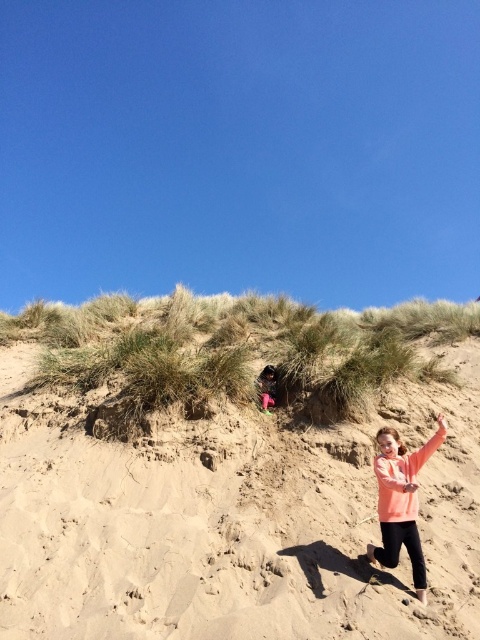
Looking at this image, is green grassy hillside at upper center behind pink fabric at center?

No, green grassy hillside at upper center is closer to the viewer.

At what (x,y) coordinates should I click in order to perform the action: click on green grassy hillside at upper center. Please return your answer as a coordinate pair (x, y). The image size is (480, 640). Looking at the image, I should click on (228, 520).

Image resolution: width=480 pixels, height=640 pixels. What are the coordinates of `green grassy hillside at upper center` in the screenshot? It's located at (228, 520).

Which of these two, matte peach hoodie at lower right or pink fabric at center, stands taller?

matte peach hoodie at lower right is taller.

Does matte peach hoodie at lower right have a smaller size compared to pink fabric at center?

No, matte peach hoodie at lower right is not smaller than pink fabric at center.

Between point (380, 481) and point (272, 376), which one is positioned behind?

The point (272, 376) is more distant.

Locate an element on the screen. The image size is (480, 640). matte peach hoodie at lower right is located at coordinates (400, 500).

Is green grassy hillside at upper center to the left of matte peach hoodie at lower right from the viewer's perspective?

Correct, you'll find green grassy hillside at upper center to the left of matte peach hoodie at lower right.

Between point (152, 586) and point (386, 502), which one is positioned behind?

Point (386, 502)

Is point (459, 515) closer to viewer compared to point (409, 497)?

No, it is not.

Locate an element on the screen. Image resolution: width=480 pixels, height=640 pixels. green grassy hillside at upper center is located at coordinates (228, 520).